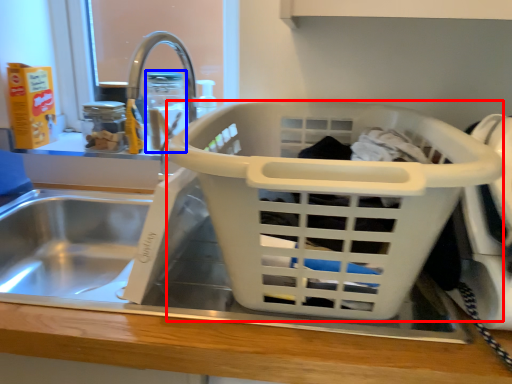
Question: Which point is closer to the camera, basket (highlighted by a red box) or bottle (highlighted by a blue box)?

Choices:
 (A) basket
 (B) bottle

Answer: (A)